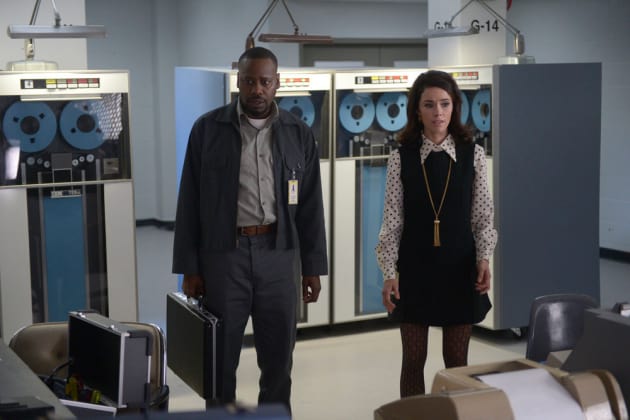
You are a GUI agent. You are given a task and a screenshot of the screen. Output one action in this format:
    pyautogui.click(x=<x>, y=<y>)
    Task: Click on the lamp
    The image size is (630, 420).
    Given the screenshot: What is the action you would take?
    pyautogui.click(x=38, y=32)